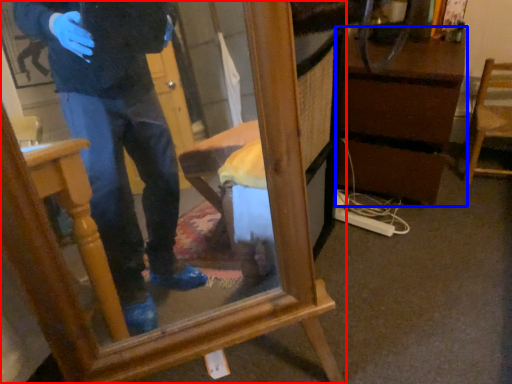
Question: Which object is further to the camera taking this photo, furniture (highlighted by a red box) or vanity (highlighted by a blue box)?

Choices:
 (A) furniture
 (B) vanity

Answer: (B)